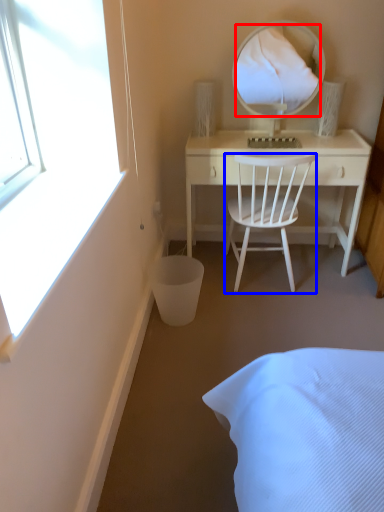
Question: Among these objects, which one is nearest to the camera, mirror (highlighted by a red box) or chair (highlighted by a blue box)?

Choices:
 (A) mirror
 (B) chair

Answer: (B)